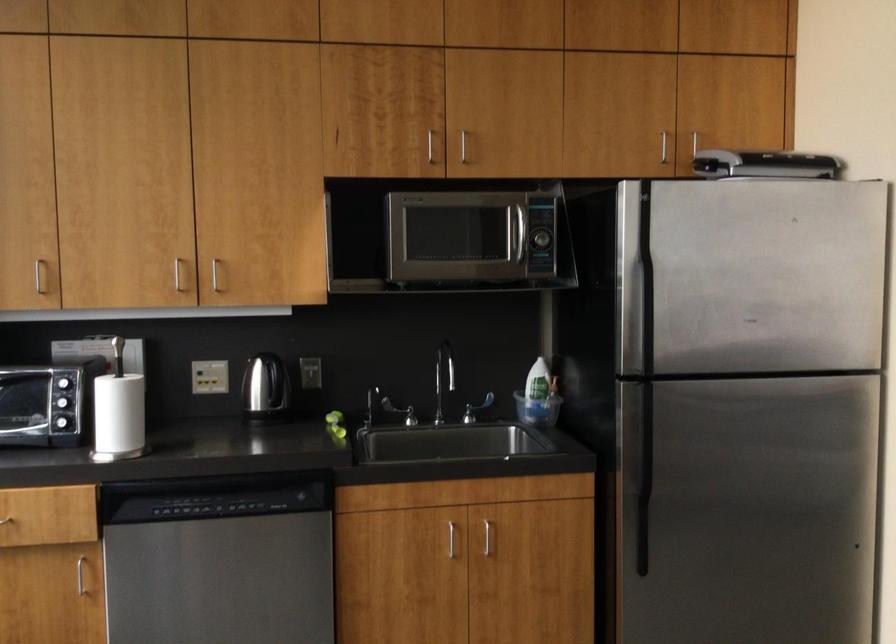
I want to click on dishwasher handle, so click(x=208, y=471).